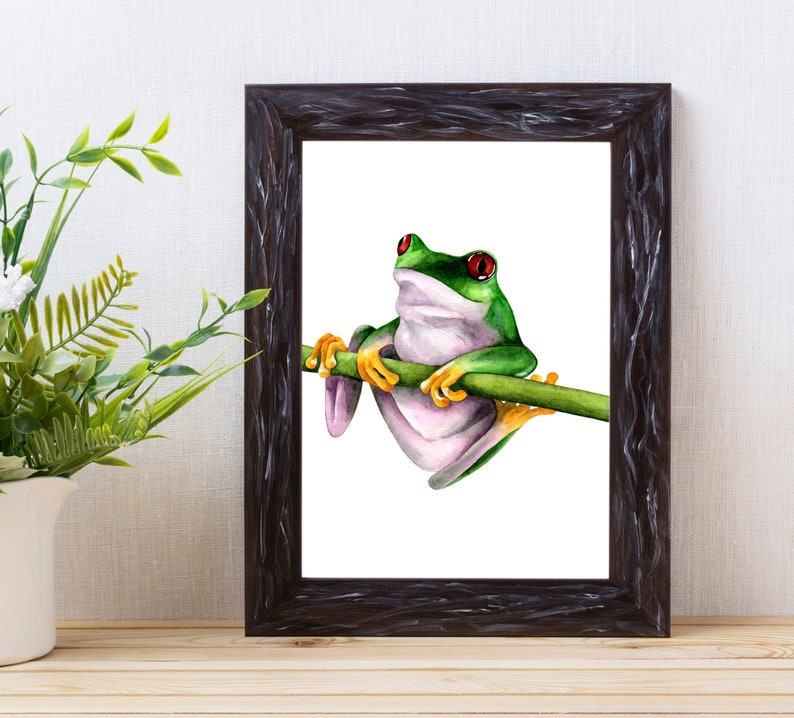
What are the coordinates of `white ceramic planter` in the screenshot? It's located at (25, 564).